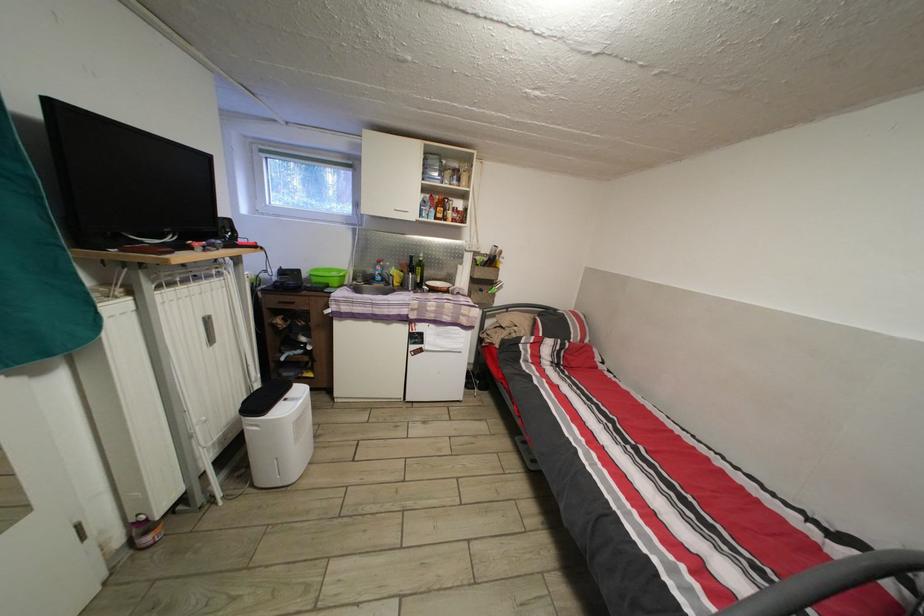
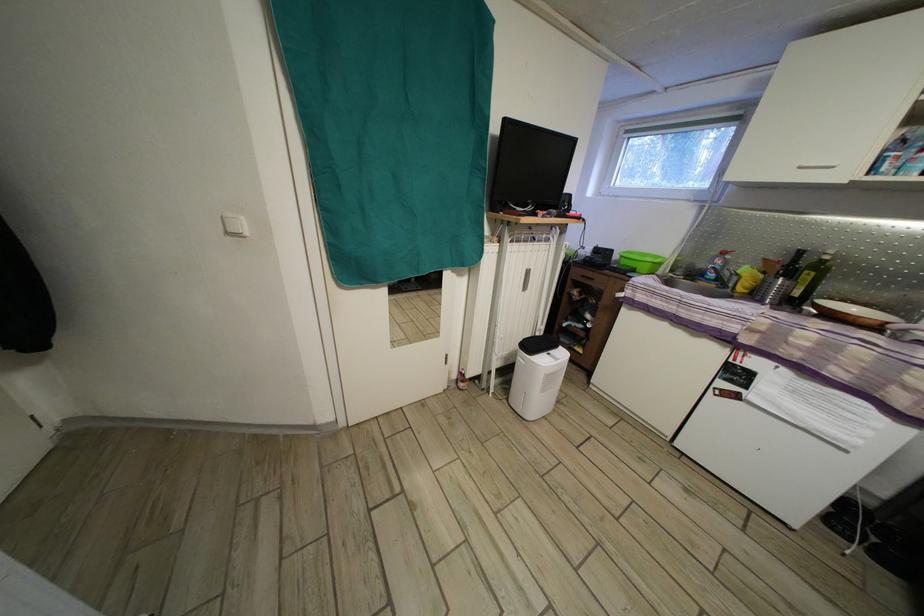
Question: The images are taken continuously from a first-person perspective. In which direction is your viewpoint rotating?

Choices:
 (A) Left
 (B) Right
 (C) Up
 (D) Down

Answer: (A)